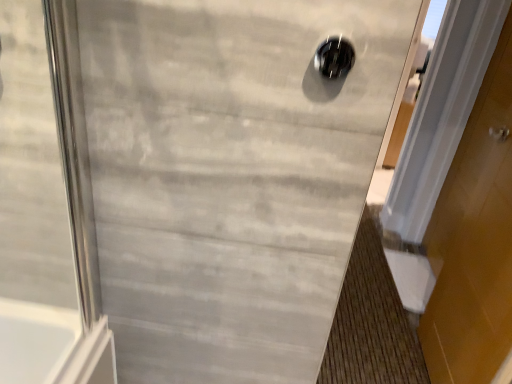
Question: Is black glossy hole at upper center positioned beyond the bounds of white wood door at right?

Choices:
 (A) no
 (B) yes

Answer: (B)

Question: Considering the relative positions of black glossy hole at upper center and white wood door at right in the image provided, is black glossy hole at upper center to the right of white wood door at right from the viewer's perspective?

Choices:
 (A) no
 (B) yes

Answer: (A)

Question: Does black glossy hole at upper center have a lesser height compared to white wood door at right?

Choices:
 (A) yes
 (B) no

Answer: (A)

Question: Can you confirm if black glossy hole at upper center is thinner than white wood door at right?

Choices:
 (A) yes
 (B) no

Answer: (A)

Question: Is black glossy hole at upper center facing towards white wood door at right?

Choices:
 (A) no
 (B) yes

Answer: (A)

Question: Is black glossy hole at upper center next to white wood door at right?

Choices:
 (A) no
 (B) yes

Answer: (A)

Question: Is white wood door at right aimed at black glossy hole at upper center?

Choices:
 (A) yes
 (B) no

Answer: (B)

Question: Considering the relative sizes of white wood door at right and black glossy hole at upper center in the image provided, is white wood door at right bigger than black glossy hole at upper center?

Choices:
 (A) no
 (B) yes

Answer: (B)

Question: Can you confirm if white wood door at right is positioned to the right of black glossy hole at upper center?

Choices:
 (A) no
 (B) yes

Answer: (B)

Question: Is white wood door at right far away from black glossy hole at upper center?

Choices:
 (A) yes
 (B) no

Answer: (A)

Question: Does white wood door at right come behind black glossy hole at upper center?

Choices:
 (A) no
 (B) yes

Answer: (B)

Question: Is white wood door at right wider than black glossy hole at upper center?

Choices:
 (A) no
 (B) yes

Answer: (B)

Question: Based on their positions, is black glossy hole at upper center located to the left or right of white wood door at right?

Choices:
 (A) left
 (B) right

Answer: (A)